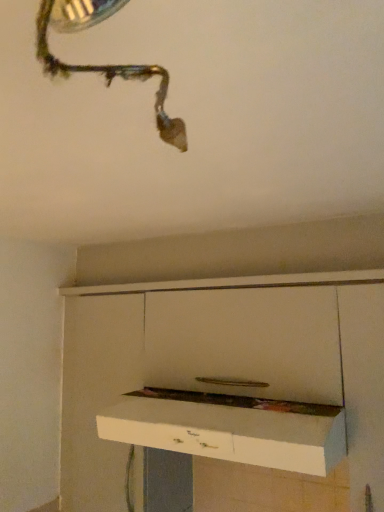
This screenshot has width=384, height=512. What do you see at coordinates (230, 428) in the screenshot?
I see `white glossy drawer at center` at bounding box center [230, 428].

Locate an element on the screen. This screenshot has width=384, height=512. white glossy drawer at center is located at coordinates pyautogui.click(x=230, y=428).

Find the location of `white glossy drawer at center`. white glossy drawer at center is located at coordinates (230, 428).